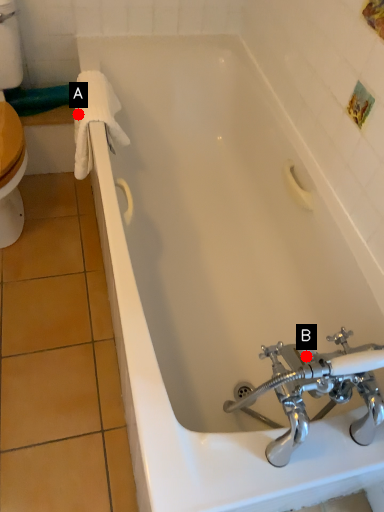
Question: Two points are circled on the image, labeled by A and B beside each circle. Which point appears farthest from the camera in this image?

Choices:
 (A) A is further
 (B) B is further

Answer: (A)